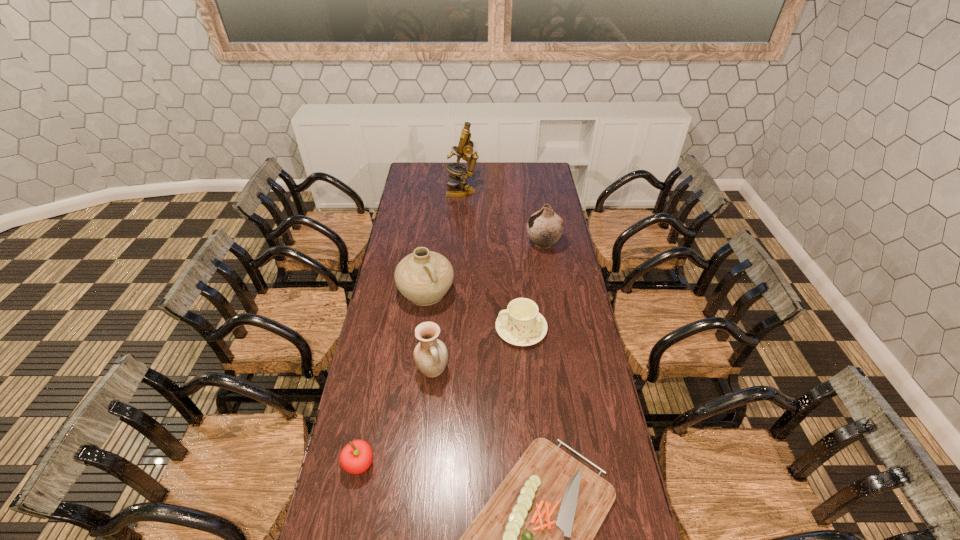
You are a GUI agent. You are given a task and a screenshot of the screen. Output one action in this format:
    pyautogui.click(x=<x>, y=<y>)
    Task: Click on the vacant point located from the spout of the farthest pottery
    This screenshot has height=540, width=960.
    Given the screenshot: What is the action you would take?
    pyautogui.click(x=488, y=245)

This screenshot has width=960, height=540. What are the coordinates of `free spot located from the spout of the farthest pottery` in the screenshot? It's located at (464, 245).

Identify the location of free space located 0.050m from the spout of the farthest pottery. Image resolution: width=960 pixels, height=540 pixels. (516, 245).

The image size is (960, 540). I want to click on vacant space situated 0.350m on the right of the nearest pottery, so click(542, 370).

Where is `vacant space situated 0.310m on the handle side of the chinaware`? vacant space situated 0.310m on the handle side of the chinaware is located at coordinates (420, 329).

Where is `vacant space located on the handle side of the chinaware`? Image resolution: width=960 pixels, height=540 pixels. vacant space located on the handle side of the chinaware is located at coordinates (464, 329).

Identify the location of vacant space located 0.050m on the handle side of the chinaware. The height and width of the screenshot is (540, 960). (483, 329).

Locate an element on the screen. The width and height of the screenshot is (960, 540). vacant space located 0.400m on the back of the apple is located at coordinates (382, 350).

This screenshot has height=540, width=960. Find the location of `pottery that is at the left edge`. pottery that is at the left edge is located at coordinates (423, 277).

Find the location of a particular element. The width and height of the screenshot is (960, 540). apple at the left edge is located at coordinates (356, 457).